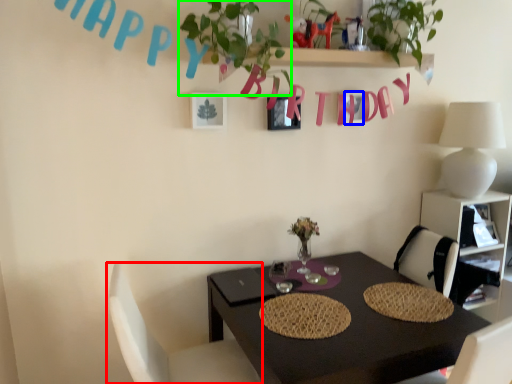
Question: Estimate the real-world distances between objects in this image. Which object is closer to chair (highlighted by a red box), alphabet (highlighted by a blue box) or plant (highlighted by a green box)?

Choices:
 (A) alphabet
 (B) plant

Answer: (B)